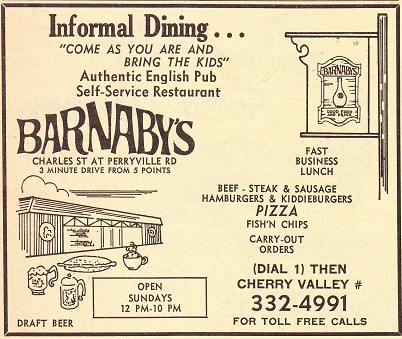
At what (x,y) coordinates should I click in order to perform the action: click on handle of beer mug. Please return your answer as a coordinate pair (x, y). This screenshot has width=402, height=339. Looking at the image, I should click on (53, 269).